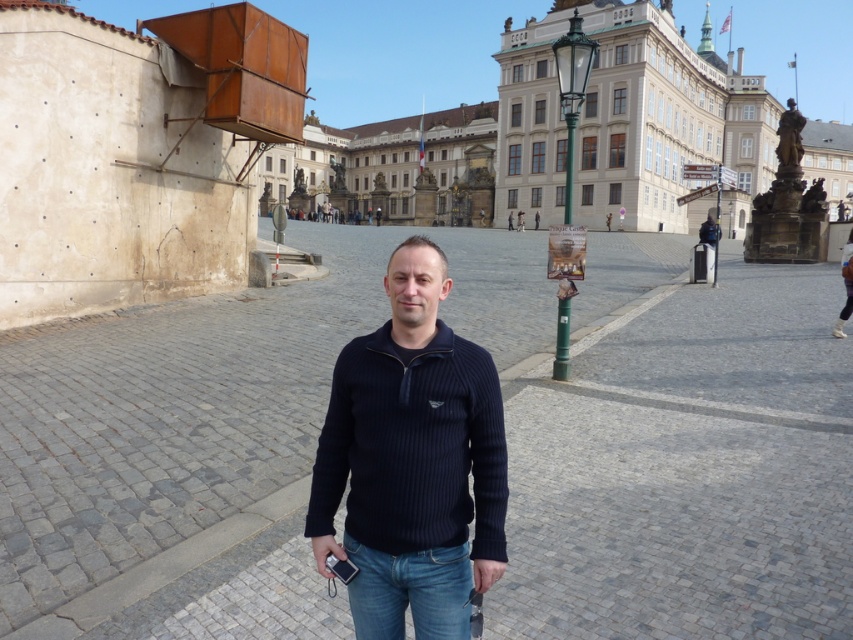
Is dark blue ribbed sweater at center below blue denim jeans at center?

No, dark blue ribbed sweater at center is not below blue denim jeans at center.

Can you confirm if dark blue ribbed sweater at center is taller than blue denim jeans at center?

Indeed, dark blue ribbed sweater at center has a greater height compared to blue denim jeans at center.

Is point (386, 545) closer to viewer compared to point (431, 582)?

No, (386, 545) is further to viewer.

Where is `dark blue ribbed sweater at center`? This screenshot has height=640, width=853. dark blue ribbed sweater at center is located at coordinates (412, 461).